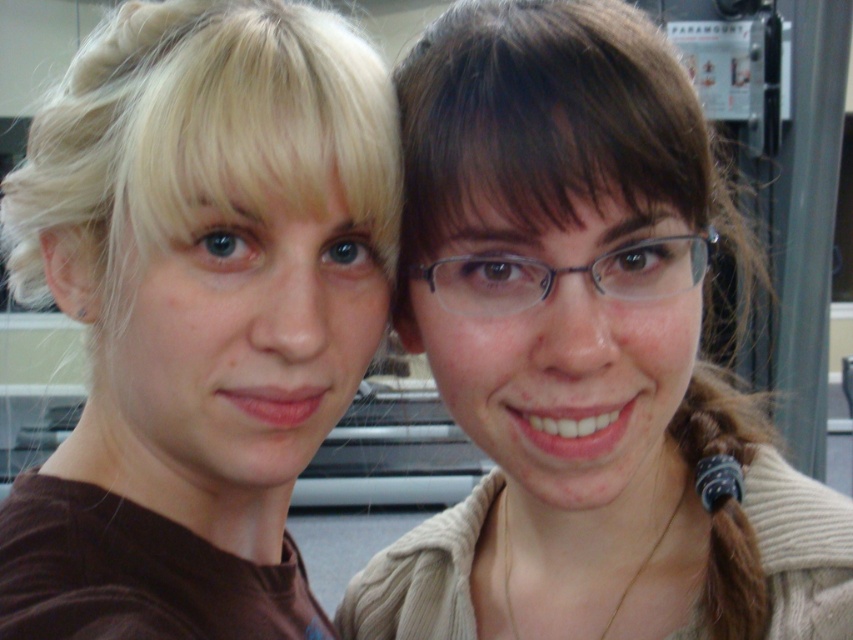
You are holding a 12 inch ruler and want to measure the distance from your eyes to the point marked as point (527, 92) in the image. Can you do it with the ruler?

The point (527, 92) is 16.78 inches away from the viewer, so yes, you can measure the distance with a 12 inch ruler since it is shorter than the distance.

You are trying to decide which item to take for a casual day out. You see the light brown sweater at center and the brown matte shirt at left. Which one is positioned to the right side of the other?

The light brown sweater at center is positioned to the right of brown matte shirt at left.